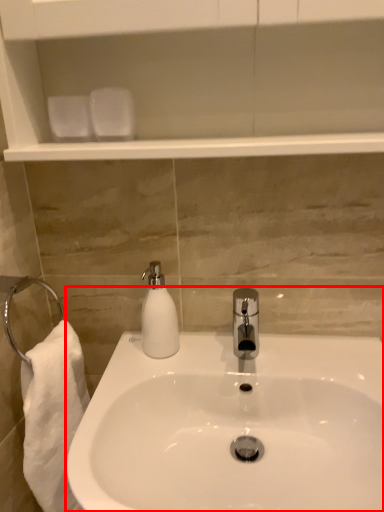
Question: From the image's perspective, what is the correct spatial positioning of sink (annotated by the red box) in reference to soap dispenser?

Choices:
 (A) below
 (B) above

Answer: (A)